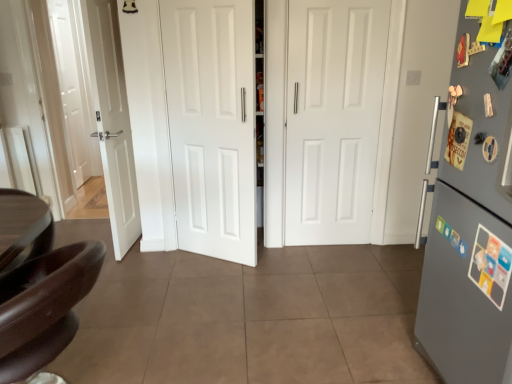
Question: From the image's perspective, is white matte door at center, which is counted as the 1th door, starting from the left, beneath white matte door at center, positioned as the first door in right-to-left order?

Choices:
 (A) no
 (B) yes

Answer: (B)

Question: Are white matte door at center, the second door viewed from the right, and white matte door at center, positioned as the first door in right-to-left order, making contact?

Choices:
 (A) yes
 (B) no

Answer: (B)

Question: Can you confirm if white matte door at center, which is counted as the 1th door, starting from the left, is shorter than white matte door at center, positioned as the first door in right-to-left order?

Choices:
 (A) yes
 (B) no

Answer: (A)

Question: Is white matte door at center, the second door viewed from the right, closer to camera compared to white matte door at center, the second door viewed from the left?

Choices:
 (A) yes
 (B) no

Answer: (A)

Question: Is white matte door at center, the second door viewed from the right, smaller than white matte door at center, positioned as the first door in right-to-left order?

Choices:
 (A) yes
 (B) no

Answer: (A)

Question: Can you confirm if white matte door at center, the second door viewed from the right, is bigger than white matte door at center, the second door viewed from the left?

Choices:
 (A) yes
 (B) no

Answer: (B)

Question: Can you confirm if white matte door at center, which is counted as the 1th door, starting from the left, is positioned to the left of shiny brown leather chair at lower left?

Choices:
 (A) yes
 (B) no

Answer: (B)

Question: Is white matte door at center, which is counted as the 1th door, starting from the left, facing away from shiny brown leather chair at lower left?

Choices:
 (A) yes
 (B) no

Answer: (B)

Question: Considering the relative sizes of white matte door at center, the second door viewed from the right, and shiny brown leather chair at lower left in the image provided, is white matte door at center, the second door viewed from the right, smaller than shiny brown leather chair at lower left?

Choices:
 (A) yes
 (B) no

Answer: (A)

Question: From the image's perspective, is white matte door at center, the second door viewed from the right, under shiny brown leather chair at lower left?

Choices:
 (A) no
 (B) yes

Answer: (A)

Question: From the image's perspective, would you say white matte door at center, the second door viewed from the right, is positioned over shiny brown leather chair at lower left?

Choices:
 (A) yes
 (B) no

Answer: (A)

Question: From a real-world perspective, is white matte door at center, which is counted as the 1th door, starting from the left, on shiny brown leather chair at lower left?

Choices:
 (A) no
 (B) yes

Answer: (B)

Question: Is gray matte refrigerator at right further to the viewer compared to white matte door at center, the second door viewed from the left?

Choices:
 (A) no
 (B) yes

Answer: (A)